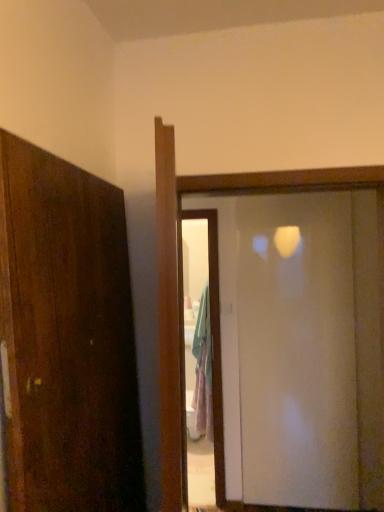
Question: Does transparent glass screen door at center appear on the right side of transparent glass door at center?

Choices:
 (A) no
 (B) yes

Answer: (B)

Question: Considering the relative positions of transparent glass screen door at center and transparent glass door at center in the image provided, is transparent glass screen door at center in front of transparent glass door at center?

Choices:
 (A) no
 (B) yes

Answer: (A)

Question: Does transparent glass screen door at center touch transparent glass door at center?

Choices:
 (A) yes
 (B) no

Answer: (B)

Question: Can you confirm if transparent glass screen door at center is thinner than transparent glass door at center?

Choices:
 (A) yes
 (B) no

Answer: (A)

Question: Considering the relative sizes of transparent glass screen door at center and transparent glass door at center in the image provided, is transparent glass screen door at center smaller than transparent glass door at center?

Choices:
 (A) no
 (B) yes

Answer: (B)

Question: Is transparent glass screen door at center to the left of transparent glass door at center from the viewer's perspective?

Choices:
 (A) no
 (B) yes

Answer: (A)

Question: From the image's perspective, would you say transparent glass door at center is shown under transparent glass screen door at center?

Choices:
 (A) no
 (B) yes

Answer: (A)

Question: Would you say transparent glass door at center is outside transparent glass screen door at center?

Choices:
 (A) yes
 (B) no

Answer: (A)

Question: From the image's perspective, is transparent glass door at center on top of transparent glass screen door at center?

Choices:
 (A) yes
 (B) no

Answer: (A)

Question: Is transparent glass door at center looking in the opposite direction of transparent glass screen door at center?

Choices:
 (A) yes
 (B) no

Answer: (A)

Question: Is transparent glass screen door at center located within transparent glass door at center?

Choices:
 (A) no
 (B) yes

Answer: (A)

Question: Does transparent glass door at center have a larger size compared to transparent glass screen door at center?

Choices:
 (A) yes
 (B) no

Answer: (A)

Question: Looking at the image, does transparent glass door at center seem bigger or smaller compared to transparent glass screen door at center?

Choices:
 (A) small
 (B) big

Answer: (B)